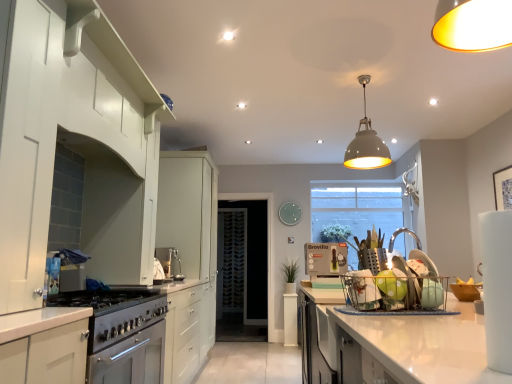
Question: In terms of width, does wooden picture frame at upper right look wider or thinner when compared to clear glass bowl at right, which is counted as the first appliance, starting from the right?

Choices:
 (A) thin
 (B) wide

Answer: (A)

Question: In the image, is wooden picture frame at upper right positioned in front of or behind clear glass bowl at right, the 5th appliance positioned from the back?

Choices:
 (A) front
 (B) behind

Answer: (B)

Question: Estimate the real-world distances between objects in this image. Which object is closer to the clear glass bowl at right, the 5th appliance positioned from the back?

Choices:
 (A) green matte apple at center
 (B) wooden picture frame at upper right
 (C) green plastic kettle at center
 (D) green matte plant at center
 (E) satin silver gas stove at lower left

Answer: (A)

Question: Which of these objects is positioned closest to the transparent glass door at center?

Choices:
 (A) green matte apple at center
 (B) satin silver gas stove at lower left
 (C) white matte pendant light at upper center
 (D) polka dot ceramic dish rack at right, the third appliance when ordered from front to back
 (E) white glossy cabinet at left, which ranks as the first cabinetry in back-to-front order

Answer: (E)